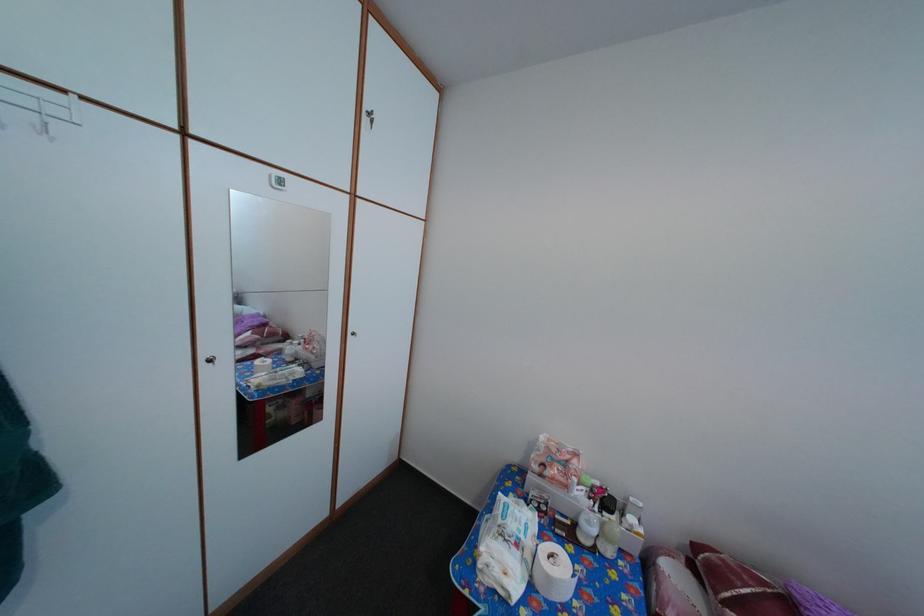
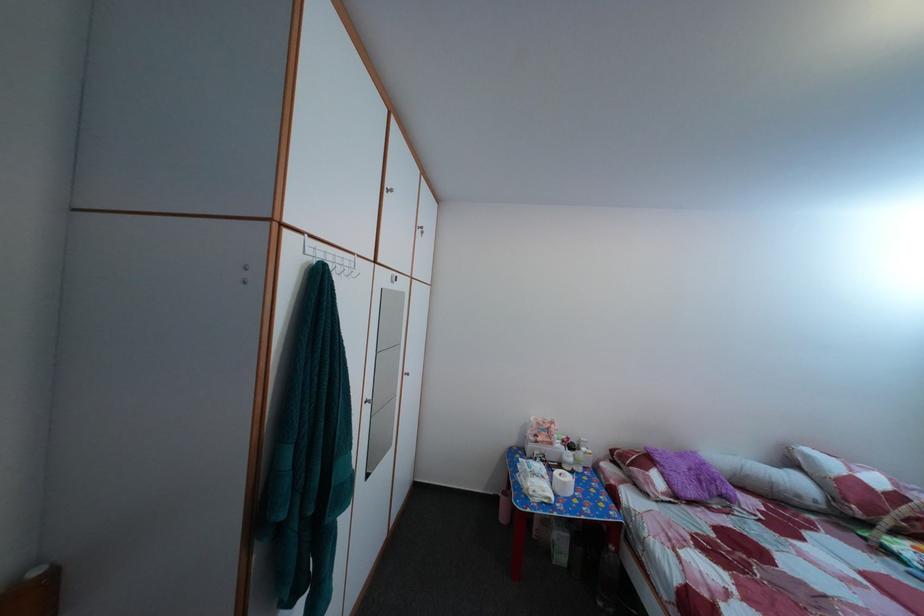
In the second image, find the point that corresponds to (555,522) in the first image.

(555, 469)